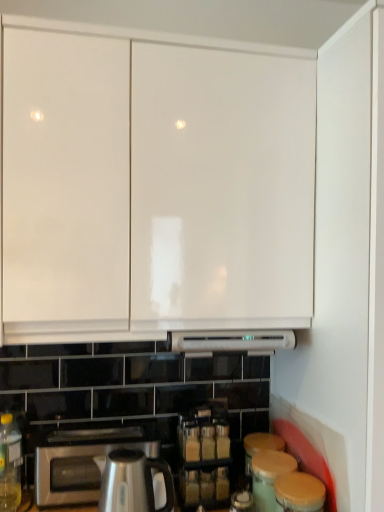
Image resolution: width=384 pixels, height=512 pixels. What are the coordinates of `satin silver kettle at lower center` in the screenshot? It's located at (134, 482).

What do you see at coordinates (10, 464) in the screenshot?
I see `translucent yellow bottle at lower left` at bounding box center [10, 464].

In order to face translucent yellow bottle at lower left, should I rotate leftwards or rightwards?

It's best to rotate left around 23.960 degrees.

Identify the location of white glossy cabinet at upper center. Image resolution: width=384 pixels, height=512 pixels. (155, 188).

Measure the distance between satin silver toaster at lower left and satin silver kettle at lower center.

satin silver toaster at lower left and satin silver kettle at lower center are 3.73 inches apart.

Between satin silver toaster at lower left and satin silver kettle at lower center, which one appears on the right side from the viewer's perspective?

satin silver kettle at lower center.

From the image's perspective, which is above, satin silver toaster at lower left or satin silver kettle at lower center?

satin silver kettle at lower center is shown above in the image.

Is satin silver toaster at lower left not inside satin silver kettle at lower center?

Indeed, satin silver toaster at lower left is completely outside satin silver kettle at lower center.

Is white glossy cabinet at upper center in front of or behind satin silver toaster at lower left in the image?

white glossy cabinet at upper center is in front of satin silver toaster at lower left.

Are white glossy cabinet at upper center and satin silver toaster at lower left far apart?

They are positioned close to each other.

How many degrees apart are the facing directions of white glossy cabinet at upper center and satin silver toaster at lower left?

0.167 degrees.

Who is smaller, white glossy cabinet at upper center or satin silver toaster at lower left?

Smaller between the two is satin silver toaster at lower left.

In terms of size, does satin silver kettle at lower center appear bigger or smaller than translucent yellow bottle at lower left?

satin silver kettle at lower center is bigger than translucent yellow bottle at lower left.

Which of these two, satin silver kettle at lower center or translucent yellow bottle at lower left, stands shorter?

With less height is satin silver kettle at lower center.

How different are the orientations of satin silver kettle at lower center and white glossy cabinet at upper center in degrees?

The angle between the facing direction of satin silver kettle at lower center and the facing direction of white glossy cabinet at upper center is 0.00751 degrees.

Between satin silver kettle at lower center and white glossy cabinet at upper center, which one has less height?

With less height is satin silver kettle at lower center.

Between satin silver kettle at lower center and white glossy cabinet at upper center, which one has larger size?

white glossy cabinet at upper center is bigger.

From a real-world perspective, is satin silver kettle at lower center below white glossy cabinet at upper center?

Yes, from a real-world perspective, satin silver kettle at lower center is under white glossy cabinet at upper center.

Is satin silver kettle at lower center outside of satin silver toaster at lower left?

Yes.

You are a GUI agent. You are given a task and a screenshot of the screen. Output one action in this format:
    pyautogui.click(x=<x>, y=<y>)
    Task: Click on the kitchen appliance that appears above the satin silver toaster at lower left (from a real-world perspective)
    
    Given the screenshot: What is the action you would take?
    point(134,482)

From a real-world perspective, which object stands above the other?

satin silver kettle at lower center.

In terms of height, does satin silver kettle at lower center look taller or shorter compared to satin silver toaster at lower left?

satin silver kettle at lower center is taller than satin silver toaster at lower left.

From the image's perspective, is translucent yellow bottle at lower left positioned above or below white glossy cabinet at upper center?

From the image's perspective, translucent yellow bottle at lower left appears below white glossy cabinet at upper center.

Would you say translucent yellow bottle at lower left is inside or outside white glossy cabinet at upper center?

translucent yellow bottle at lower left is not inside white glossy cabinet at upper center, it's outside.

Based on the photo, considering the positions of objects translucent yellow bottle at lower left and white glossy cabinet at upper center in the image provided, who is in front, translucent yellow bottle at lower left or white glossy cabinet at upper center?

white glossy cabinet at upper center is more forward.

Can you tell me how much translucent yellow bottle at lower left and satin silver kettle at lower center differ in facing direction?

The angle between the facing direction of translucent yellow bottle at lower left and the facing direction of satin silver kettle at lower center is 0.243 degrees.

From the image's perspective, who appears lower, translucent yellow bottle at lower left or satin silver kettle at lower center?

satin silver kettle at lower center.

Is translucent yellow bottle at lower left with satin silver kettle at lower center?

translucent yellow bottle at lower left is not next to satin silver kettle at lower center, and they're not touching.

Does point (4, 508) come closer to viewer compared to point (164, 503)?

No, (4, 508) is behind (164, 503).

Where is `kitchen appliance located above the satin silver toaster at lower left (from the image's perspective)`? kitchen appliance located above the satin silver toaster at lower left (from the image's perspective) is located at coordinates (134, 482).

I want to click on home appliance on the left of white glossy cabinet at upper center, so click(84, 461).

Looking at the image, which one is located further to satin silver toaster at lower left, white glossy cabinet at upper center or translucent yellow bottle at lower left?

The object further to satin silver toaster at lower left is white glossy cabinet at upper center.

Estimate the real-world distances between objects in this image. Which object is further from white glossy cabinet at upper center, translucent yellow bottle at lower left or satin silver toaster at lower left?

Based on the image, translucent yellow bottle at lower left appears to be further to white glossy cabinet at upper center.

When comparing their distances from white glossy cabinet at upper center, does satin silver kettle at lower center or satin silver toaster at lower left seem closer?

Based on the image, satin silver kettle at lower center appears to be nearer to white glossy cabinet at upper center.

From the image, which object appears to be farther from satin silver kettle at lower center, translucent yellow bottle at lower left or satin silver toaster at lower left?

Among the two, translucent yellow bottle at lower left is located further to satin silver kettle at lower center.

When comparing their distances from white glossy cabinet at upper center, does translucent yellow bottle at lower left or satin silver kettle at lower center seem further?

Based on the image, translucent yellow bottle at lower left appears to be further to white glossy cabinet at upper center.

When comparing their distances from translucent yellow bottle at lower left, does satin silver toaster at lower left or satin silver kettle at lower center seem further?

Based on the image, satin silver kettle at lower center appears to be further to translucent yellow bottle at lower left.

Looking at the image, which one is located closer to satin silver kettle at lower center, white glossy cabinet at upper center or translucent yellow bottle at lower left?

translucent yellow bottle at lower left lies closer to satin silver kettle at lower center than the other object.

Estimate the real-world distances between objects in this image. Which object is closer to white glossy cabinet at upper center, satin silver kettle at lower center or translucent yellow bottle at lower left?

Among the two, satin silver kettle at lower center is located nearer to white glossy cabinet at upper center.

In order to click on kitchen appliance between white glossy cabinet at upper center and satin silver toaster at lower left in the vertical direction in this screenshot , I will do 134,482.

You are a GUI agent. You are given a task and a screenshot of the screen. Output one action in this format:
    pyautogui.click(x=<x>, y=<y>)
    Task: Click on the bottle between white glossy cabinet at upper center and satin silver kettle at lower center from top to bottom
    This screenshot has width=384, height=512.
    Given the screenshot: What is the action you would take?
    pyautogui.click(x=10, y=464)

The width and height of the screenshot is (384, 512). Identify the location of bottle between white glossy cabinet at upper center and satin silver toaster at lower left from top to bottom. (10, 464).

The image size is (384, 512). Identify the location of home appliance situated between translucent yellow bottle at lower left and satin silver kettle at lower center from left to right. (84, 461).